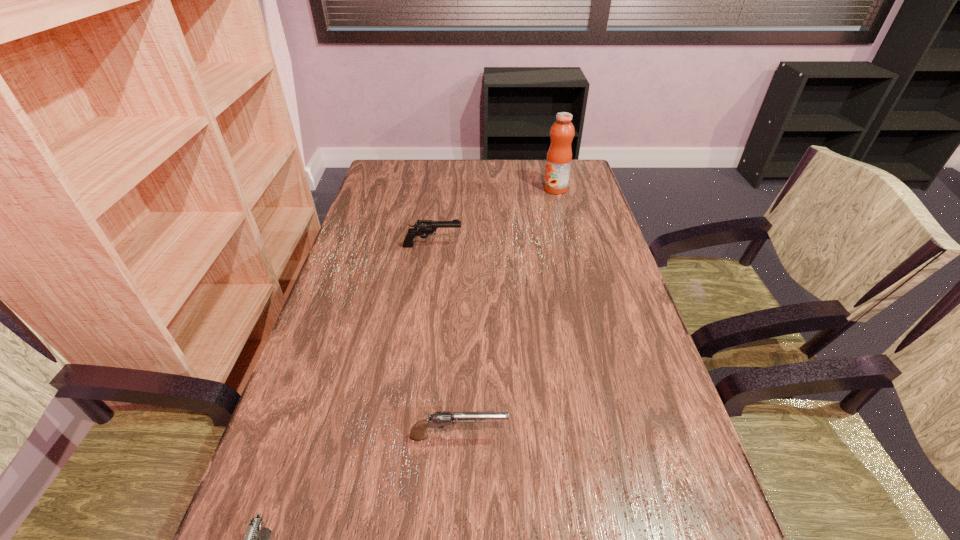
Where is `fruit juice`? fruit juice is located at coordinates (559, 156).

You are a GUI agent. You are given a task and a screenshot of the screen. Output one action in this format:
    pyautogui.click(x=<x>, y=<y>)
    Task: Click on the farthest object
    
    Given the screenshot: What is the action you would take?
    pyautogui.click(x=559, y=156)

At what (x,y) coordinates should I click in order to perform the action: click on the third nearest object. Please return your answer as a coordinate pair (x, y). Looking at the image, I should click on pyautogui.click(x=424, y=227).

I want to click on the farthest gun, so pos(424,227).

The width and height of the screenshot is (960, 540). In order to click on the second nearest gun in this screenshot , I will do `click(418, 432)`.

Locate an element on the screen. Image resolution: width=960 pixels, height=540 pixels. vacant space situated on the front label of the fruit juice is located at coordinates pyautogui.click(x=515, y=189).

Locate an element on the screen. blank area located 0.320m on the front label of the fruit juice is located at coordinates (451, 189).

Identify the location of free location located on the front label of the fruit juice. (468, 189).

I want to click on free space located at the end of the barrel of the third nearest object, so click(x=486, y=246).

The height and width of the screenshot is (540, 960). I want to click on free space located aiming along the barrel of the third farthest object, so pyautogui.click(x=645, y=436).